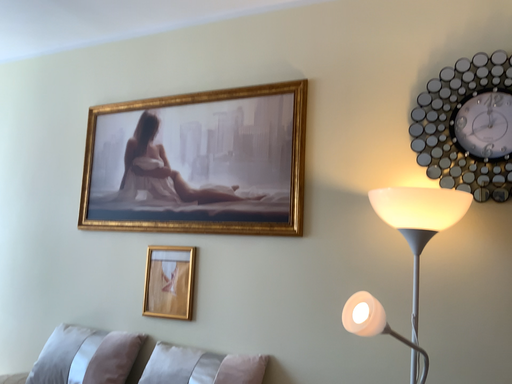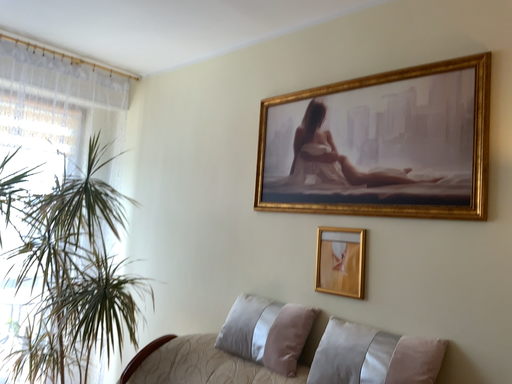
Question: How did the camera likely rotate when shooting the video?

Choices:
 (A) rotated left
 (B) rotated right

Answer: (A)